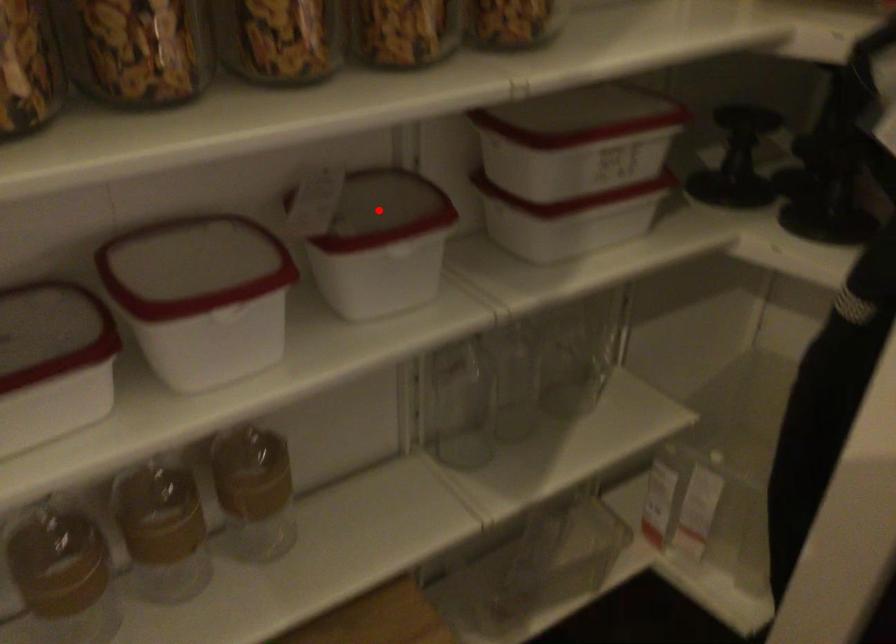
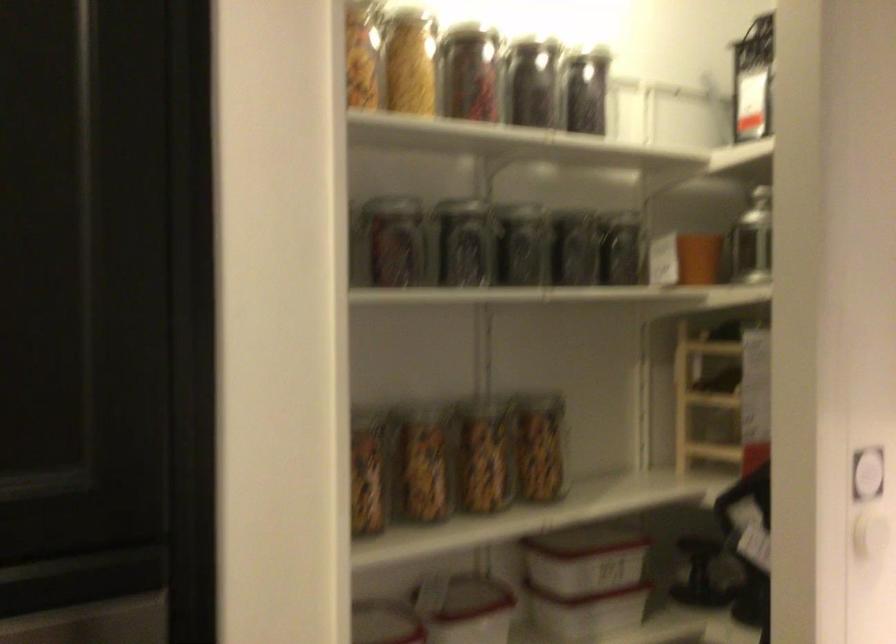
The point at the highlighted location is marked in the first image. Where is the corresponding point in the second image?

(464, 605)